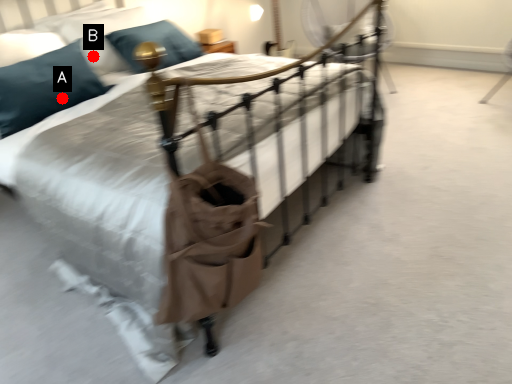
Question: Two points are circled on the image, labeled by A and B beside each circle. Which point appears closest to the camera in this image?

Choices:
 (A) A is closer
 (B) B is closer

Answer: (A)